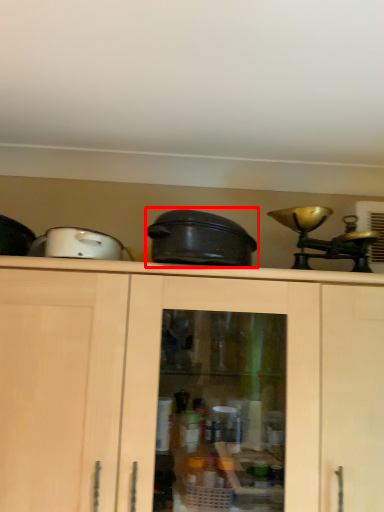
Question: From the image's perspective, what is the correct spatial relationship of crock pot (annotated by the red box) in relation to appliance?

Choices:
 (A) below
 (B) above

Answer: (A)